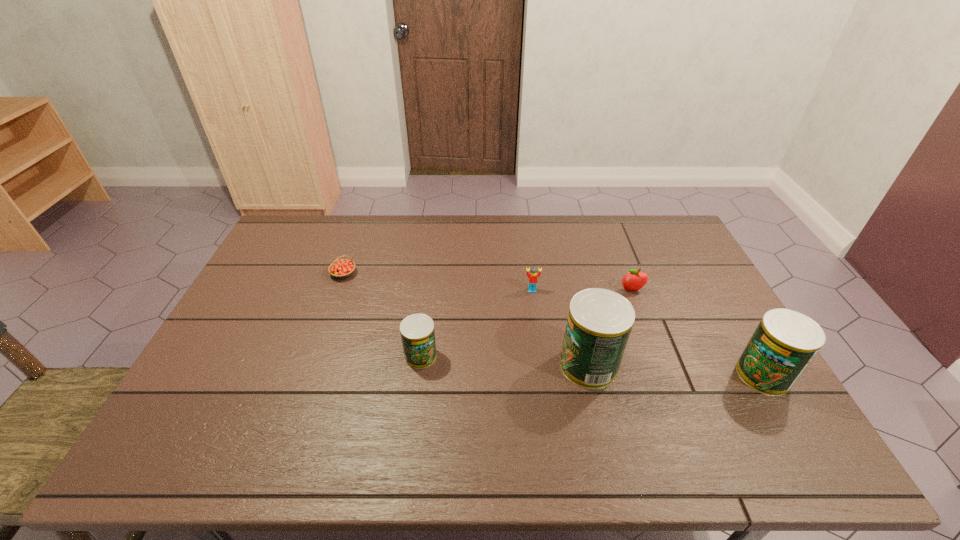
Where is `free space located 0.080m on the right of the second can from right to left`? free space located 0.080m on the right of the second can from right to left is located at coordinates (647, 365).

Where is `vacant area located 0.160m on the left of the fifth shortest object`? The width and height of the screenshot is (960, 540). vacant area located 0.160m on the left of the fifth shortest object is located at coordinates (677, 375).

You are a GUI agent. You are given a task and a screenshot of the screen. Output one action in this format:
    pyautogui.click(x=<x>, y=<y>)
    Task: Click on the free location located on the front of the shortest object
    The width and height of the screenshot is (960, 540).
    Given the screenshot: What is the action you would take?
    pyautogui.click(x=309, y=370)

This screenshot has width=960, height=540. Identify the location of blank space located on the face of the Lego. (537, 323).

Find the location of a particular element. The image size is (960, 540). vacant area located on the left of the apple is located at coordinates (519, 291).

Identify the location of object located at the near edge. (784, 343).

This screenshot has height=540, width=960. I want to click on object that is at the right edge, so click(784, 343).

In order to click on object present at the near right corner in this screenshot , I will do `click(784, 343)`.

In the image, there is a desktop. Where is `vacant space at the far edge`? vacant space at the far edge is located at coordinates (328, 249).

In the image, there is a desktop. Identify the location of vacant region at the left edge. Image resolution: width=960 pixels, height=540 pixels. pos(274,281).